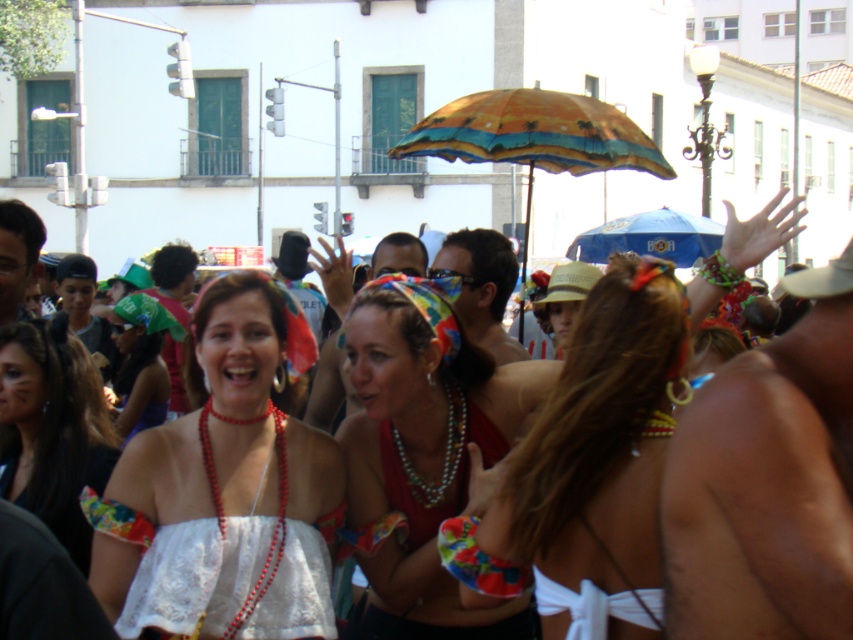
Consider the image. Does white fabric bikini at center appear on the right side of blue fabric umbrella at upper center?

No, white fabric bikini at center is not to the right of blue fabric umbrella at upper center.

Is white fabric bikini at center shorter than blue fabric umbrella at upper center?

Correct, white fabric bikini at center is not as tall as blue fabric umbrella at upper center.

Who is more distant from viewer, (578, 570) or (677, 253)?

Positioned behind is point (677, 253).

Identify the location of white fabric bikini at center. (589, 470).

Based on the photo, does white lace top at center appear on the right side of white lace dress at center?

Incorrect, white lace top at center is not on the right side of white lace dress at center.

Is white lace top at center thinner than white lace dress at center?

Correct, white lace top at center's width is less than white lace dress at center's.

The width and height of the screenshot is (853, 640). What do you see at coordinates (225, 492) in the screenshot?
I see `white lace top at center` at bounding box center [225, 492].

Where is `white lace top at center`? The image size is (853, 640). white lace top at center is located at coordinates (225, 492).

Image resolution: width=853 pixels, height=640 pixels. What do you see at coordinates (589, 470) in the screenshot?
I see `white fabric bikini at center` at bounding box center [589, 470].

Can you confirm if white fabric bikini at center is bigger than white lace bikini top at center?

Actually, white fabric bikini at center might be smaller than white lace bikini top at center.

This screenshot has height=640, width=853. Identify the location of white fabric bikini at center. (589, 470).